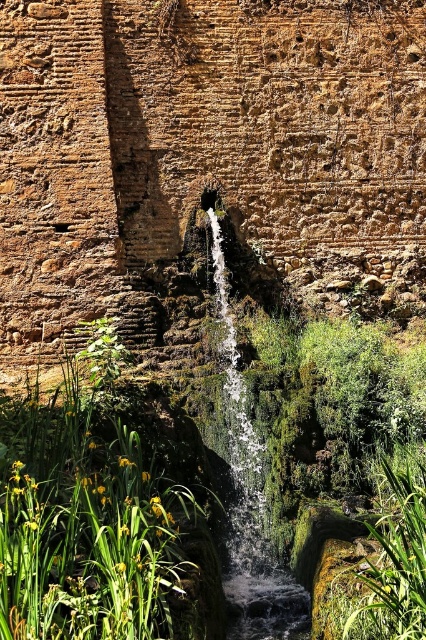
Question: Can you confirm if green leafy plants at lower left is positioned above green leafy plant at lower right?

Choices:
 (A) no
 (B) yes

Answer: (B)

Question: Which point is farther to the camera?

Choices:
 (A) (224, 582)
 (B) (91, 563)
 (C) (411, 516)

Answer: (A)

Question: Which point is farther from the camera taking this photo?

Choices:
 (A) (42, 454)
 (B) (391, 612)

Answer: (A)

Question: Considering the relative positions of green leafy plants at lower left and green leafy plant at lower right in the image provided, where is green leafy plants at lower left located with respect to green leafy plant at lower right?

Choices:
 (A) above
 (B) below

Answer: (A)

Question: Which point is farther to the camera?

Choices:
 (A) green leafy plant at lower right
 (B) green leafy plants at lower left
 (C) clear water at center

Answer: (C)

Question: Can you confirm if green leafy plants at lower left is thinner than clear water at center?

Choices:
 (A) yes
 (B) no

Answer: (B)